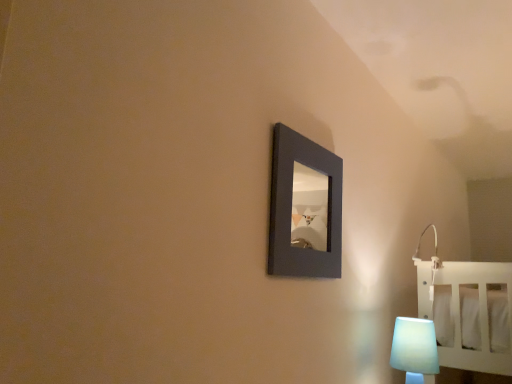
Describe the element at coordinates (304, 208) in the screenshot. I see `matte black picture frame at center` at that location.

I want to click on matte black picture frame at center, so click(x=304, y=208).

Measure the distance between matte black picture frame at center and camera.

They are 4.49 meters apart.

Looking at this image, measure the distance between translucent white lampshade at lower right and camera.

translucent white lampshade at lower right and camera are 1.39 meters apart from each other.

Image resolution: width=512 pixels, height=384 pixels. What do you see at coordinates (414, 348) in the screenshot? I see `translucent white lampshade at lower right` at bounding box center [414, 348].

You are a GUI agent. You are given a task and a screenshot of the screen. Output one action in this format:
    pyautogui.click(x=<x>, y=<y>)
    Task: Click on the translucent white lampshade at lower right
    The width and height of the screenshot is (512, 384).
    Given the screenshot: What is the action you would take?
    pyautogui.click(x=414, y=348)

Locate an element on the screen. matte black picture frame at center is located at coordinates (304, 208).

Can you confirm if matte black picture frame at center is positioned to the right of translucent white lampshade at lower right?

In fact, matte black picture frame at center is to the left of translucent white lampshade at lower right.

Considering the positions of objects matte black picture frame at center and translucent white lampshade at lower right in the image provided, who is behind, matte black picture frame at center or translucent white lampshade at lower right?

translucent white lampshade at lower right is further from the camera.

Is point (330, 205) closer to camera compared to point (421, 346)?

That is True.

From the image's perspective, is matte black picture frame at center positioned above or below translucent white lampshade at lower right?

Based on their image positions, matte black picture frame at center is located above translucent white lampshade at lower right.

From a real-world perspective, which object rests below the other?

From a 3D spatial view, translucent white lampshade at lower right is below.

Between matte black picture frame at center and translucent white lampshade at lower right, which one has smaller width?

matte black picture frame at center.

Looking at this image, between matte black picture frame at center and translucent white lampshade at lower right, which one has more height?

matte black picture frame at center is taller.

Does matte black picture frame at center have a larger size compared to translucent white lampshade at lower right?

Yes.

Is matte black picture frame at center located outside translucent white lampshade at lower right?

Yes, matte black picture frame at center is located beyond the bounds of translucent white lampshade at lower right.

Based on the photo, is matte black picture frame at center directly adjacent to translucent white lampshade at lower right?

No, matte black picture frame at center is not in contact with translucent white lampshade at lower right.

Is translucent white lampshade at lower right at the back of matte black picture frame at center?

No.

How different are the orientations of matte black picture frame at center and translucent white lampshade at lower right in degrees?

matte black picture frame at center and translucent white lampshade at lower right are facing 0.00151 degrees away from each other.

How much distance is there between matte black picture frame at center and translucent white lampshade at lower right?

matte black picture frame at center is 3.16 meters away from translucent white lampshade at lower right.

Locate an element on the screen. lamp below the matte black picture frame at center (from the image's perspective) is located at coordinates (414, 348).

Considering the positions of objects translucent white lampshade at lower right and matte black picture frame at center in the image provided, who is more to the right, translucent white lampshade at lower right or matte black picture frame at center?

translucent white lampshade at lower right.

Is translucent white lampshade at lower right in front of or behind matte black picture frame at center in the image?

Visually, translucent white lampshade at lower right is located behind matte black picture frame at center.

Does point (392, 359) appear closer or farther from the camera than point (336, 267)?

Point (392, 359).

From the image's perspective, who appears lower, translucent white lampshade at lower right or matte black picture frame at center?

From the image's view, translucent white lampshade at lower right is below.

From a real-world perspective, which is physically above, translucent white lampshade at lower right or matte black picture frame at center?

matte black picture frame at center is physically above.

Which of these two, translucent white lampshade at lower right or matte black picture frame at center, is thinner?

With smaller width is matte black picture frame at center.

Which of these two, translucent white lampshade at lower right or matte black picture frame at center, stands taller?

Standing taller between the two is matte black picture frame at center.

Can you confirm if translucent white lampshade at lower right is smaller than matte black picture frame at center?

Yes.

Is translucent white lampshade at lower right located outside matte black picture frame at center?

Indeed, translucent white lampshade at lower right is completely outside matte black picture frame at center.

Is translucent white lampshade at lower right not near matte black picture frame at center?

translucent white lampshade at lower right is far away from matte black picture frame at center.

Is translucent white lampshade at lower right oriented towards matte black picture frame at center?

No, translucent white lampshade at lower right is not facing towards matte black picture frame at center.

You are a GUI agent. You are given a task and a screenshot of the screen. Output one action in this format:
    pyautogui.click(x=<x>, y=<y>)
    Task: Click on the picture frame that appears in front of the translucent white lampshade at lower right
    
    Given the screenshot: What is the action you would take?
    pyautogui.click(x=304, y=208)

Locate an element on the screen. Image resolution: width=512 pixels, height=384 pixels. picture frame lying in front of the translucent white lampshade at lower right is located at coordinates (x=304, y=208).

Locate an element on the screen. lamp behind the matte black picture frame at center is located at coordinates (414, 348).